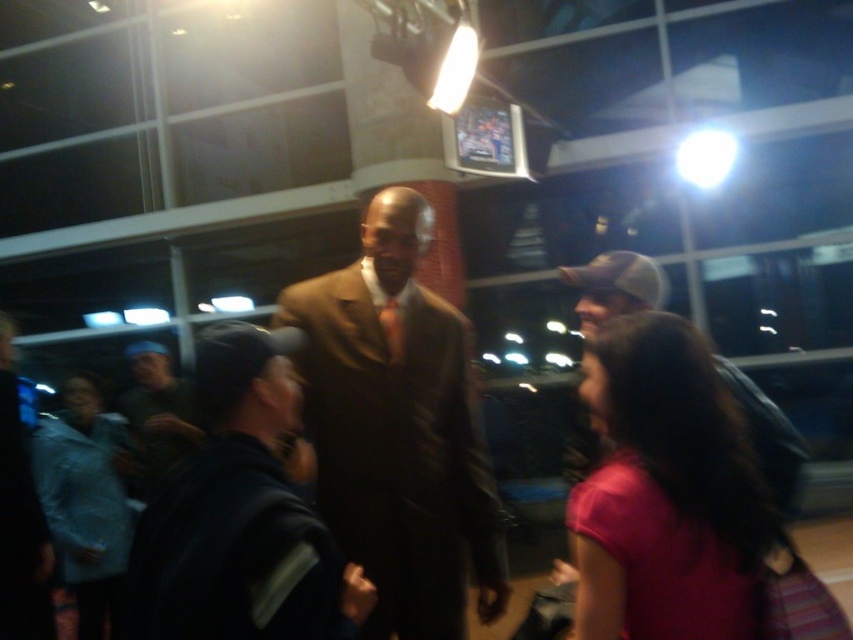
What is located at the coordinates point (398, 429) in the image?

The brown suit at center is located at point (398, 429).

You are standing at the entrance of the room and want to find the central figure wearing a brown suit at center. According to the coordinates provided, in which direction should you look to locate him?

The brown suit at center is located at coordinates point (398,429), which means you should look towards the upper right direction from your position at the entrance to locate him.

You are a photographer at this event and want to capture a photo of the dark brown suit at center and the brown silk tie at center. If you want to ensure both are in focus, which part of the image should you focus on?

You should focus on the dark brown suit at center because it is much taller than the brown silk tie at center, so focusing on the taller object will help ensure both are in focus.